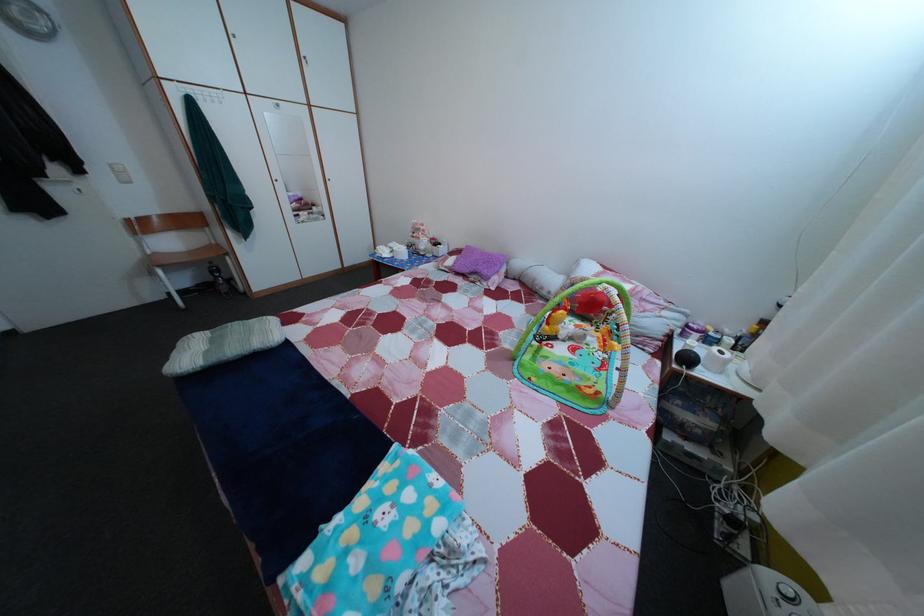
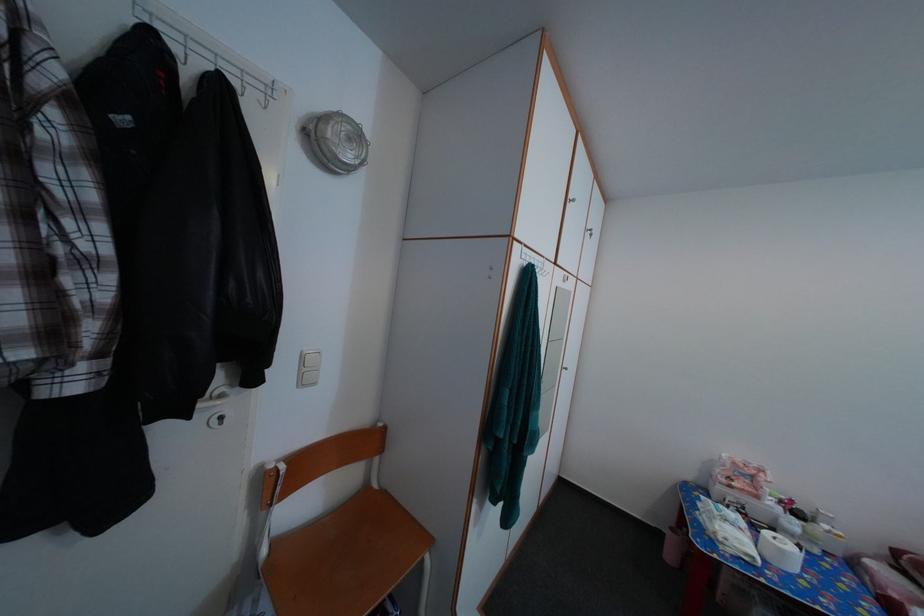
In the second image, find the point that corresponds to pixel 164 261 in the first image.

(282, 552)